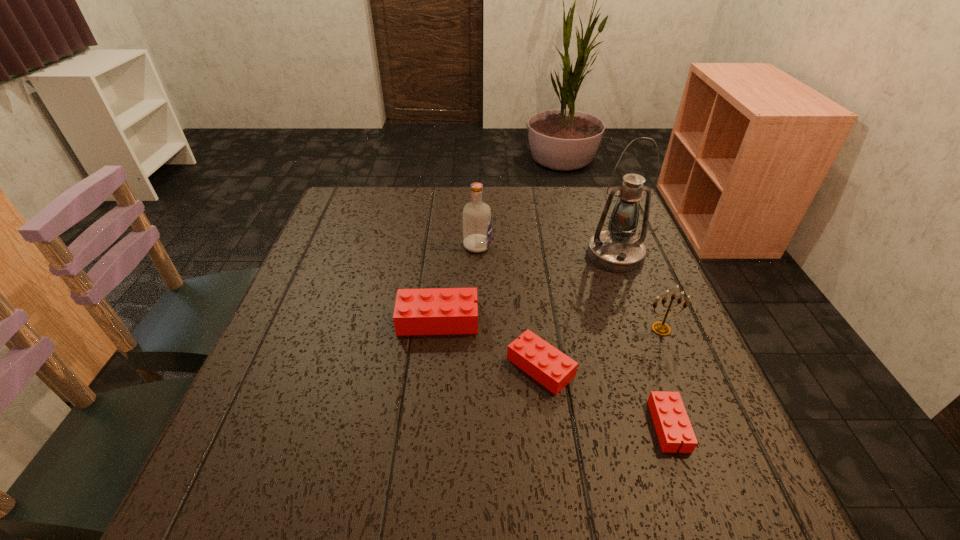
Locate an element on the screen. The image size is (960, 540). the tallest Lego is located at coordinates (438, 311).

Where is `the fourth tallest object`? the fourth tallest object is located at coordinates (438, 311).

What are the coordinates of `the second nearest Lego` in the screenshot? It's located at (553, 369).

The height and width of the screenshot is (540, 960). What are the coordinates of `the third object from left to right` in the screenshot? It's located at (553, 369).

The image size is (960, 540). Find the location of `the nearest Lego`. the nearest Lego is located at coordinates (670, 418).

Where is `the shortest Lego`? Image resolution: width=960 pixels, height=540 pixels. the shortest Lego is located at coordinates (670, 418).

I want to click on oil lamp, so click(x=617, y=249).

This screenshot has height=540, width=960. Find the location of `vodka`. vodka is located at coordinates (477, 221).

At what (x,y) coordinates should I click in order to perform the action: click on candelabrum. Please return your answer as a coordinate pair (x, y). Looking at the image, I should click on (x=661, y=328).

Locate an element on the screen. blank space located on the right of the farthest Lego is located at coordinates (559, 320).